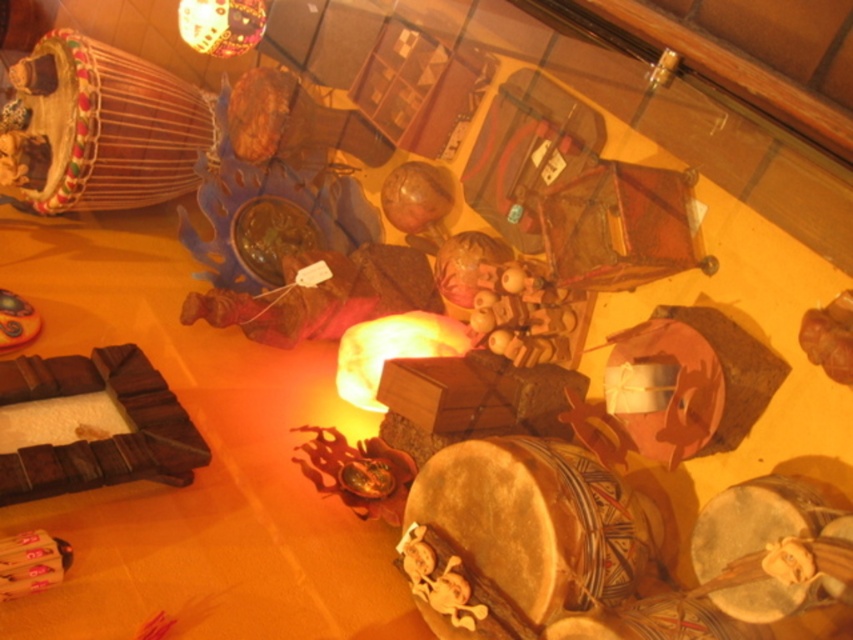
Does natural wood drum at center appear on the left side of multicolored wooden drum at upper left?

Incorrect, natural wood drum at center is not on the left side of multicolored wooden drum at upper left.

Can you confirm if natural wood drum at center is taller than multicolored wooden drum at upper left?

In fact, natural wood drum at center may be shorter than multicolored wooden drum at upper left.

This screenshot has width=853, height=640. Describe the element at coordinates (520, 538) in the screenshot. I see `natural wood drum at center` at that location.

This screenshot has height=640, width=853. Identify the location of natural wood drum at center. (520, 538).

Between point (770, 616) and point (695, 611), which one is positioned in front?

Point (770, 616)

Does point (734, 593) come closer to viewer compared to point (602, 616)?

That is True.

Who is more distant from viewer, (851, 586) or (608, 628)?

The point (608, 628) is more distant.

This screenshot has width=853, height=640. I want to click on leather drum at center, so click(x=772, y=547).

Who is shorter, natural wood drum at center or leather drum at center?

leather drum at center is shorter.

Where is `natural wood drum at center`? natural wood drum at center is located at coordinates (520, 538).

Is point (537, 529) behind point (831, 588)?

Yes, it is.

The width and height of the screenshot is (853, 640). Identify the location of natural wood drum at center. (520, 538).